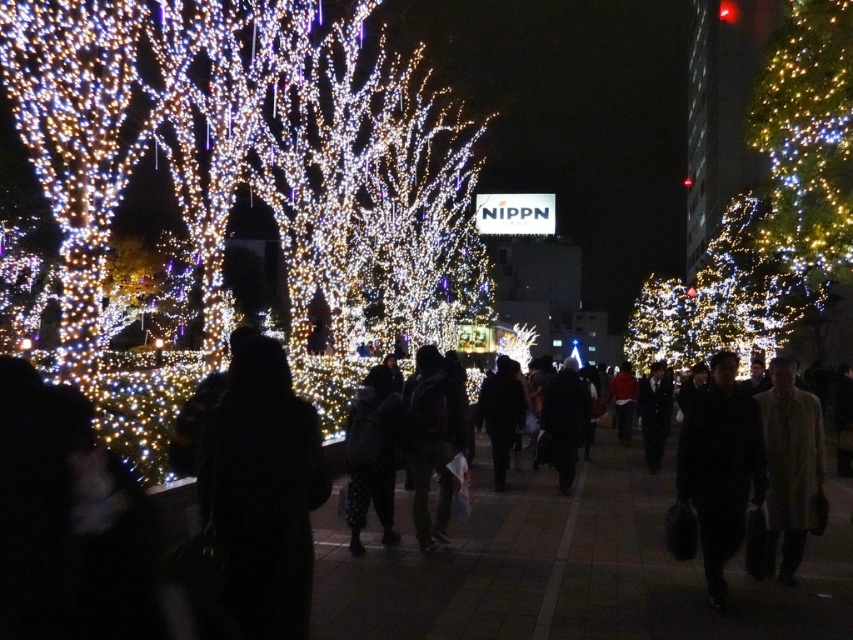
Can you confirm if black textured pants at center is positioned above dark fabric coat at center?

Actually, black textured pants at center is below dark fabric coat at center.

Based on the photo, can you confirm if black textured pants at center is smaller than dark fabric coat at center?

Yes.

Which is behind, point (381, 465) or point (577, 419)?

Point (577, 419)

At what (x,y) coordinates should I click in order to perform the action: click on black textured pants at center. Please return your answer as a coordinate pair (x, y). Looking at the image, I should click on (372, 456).

Is black matte jacket at center below dark suit at center?

Indeed, black matte jacket at center is positioned under dark suit at center.

Can you confirm if black matte jacket at center is shorter than dark suit at center?

In fact, black matte jacket at center may be taller than dark suit at center.

Which is behind, point (514, 432) or point (671, 406)?

Point (671, 406)

This screenshot has width=853, height=640. Identify the location of black matte jacket at center. (502, 413).

Does black matte coat at center appear on the left side of red matte jacket at center?

Incorrect, black matte coat at center is not on the left side of red matte jacket at center.

Who is positioned more to the left, black matte coat at center or red matte jacket at center?

Positioned to the left is red matte jacket at center.

Is point (724, 394) closer to viewer compared to point (622, 387)?

Yes, point (724, 394) is in front of point (622, 387).

This screenshot has height=640, width=853. I want to click on black matte coat at center, so click(x=720, y=467).